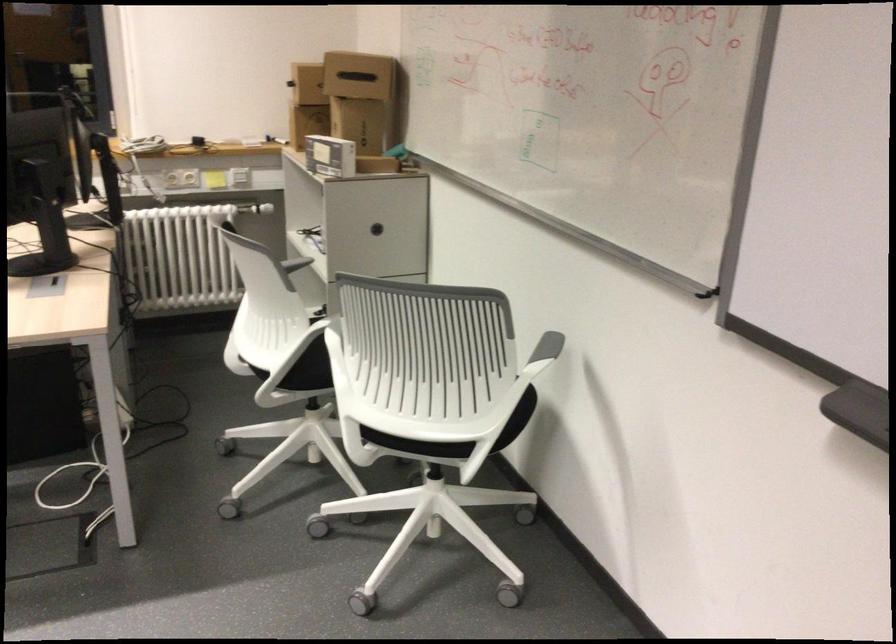
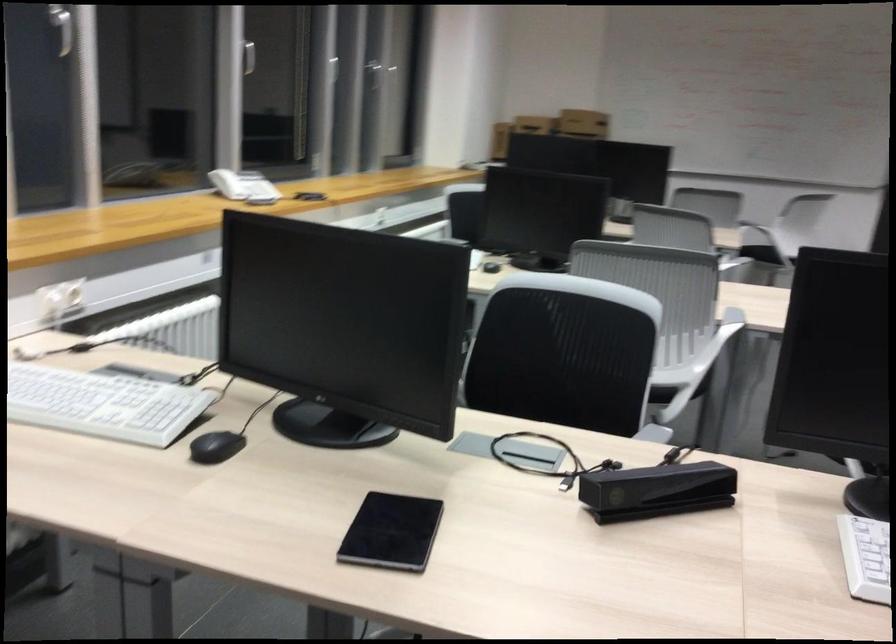
Question: I am providing you with two images of the same scene from different viewpoints. Please identify which objects are invisible in image2.

Choices:
 (A) black computer mouse
 (B) white drawer front
 (C) telephone handset
 (D) chair sitting surface

Answer: (D)